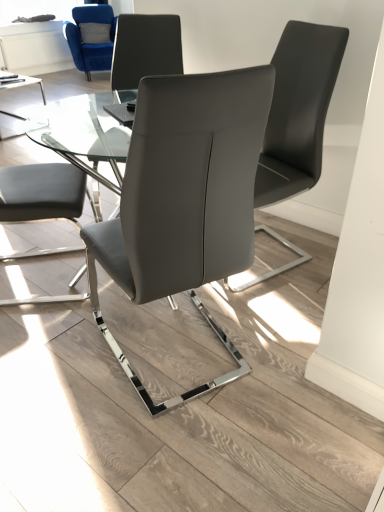
Where is `blank area to the left of matte gray chair at center, arranged as the 2th chair when viewed from the right`? Image resolution: width=384 pixels, height=512 pixels. blank area to the left of matte gray chair at center, arranged as the 2th chair when viewed from the right is located at coordinates (54, 359).